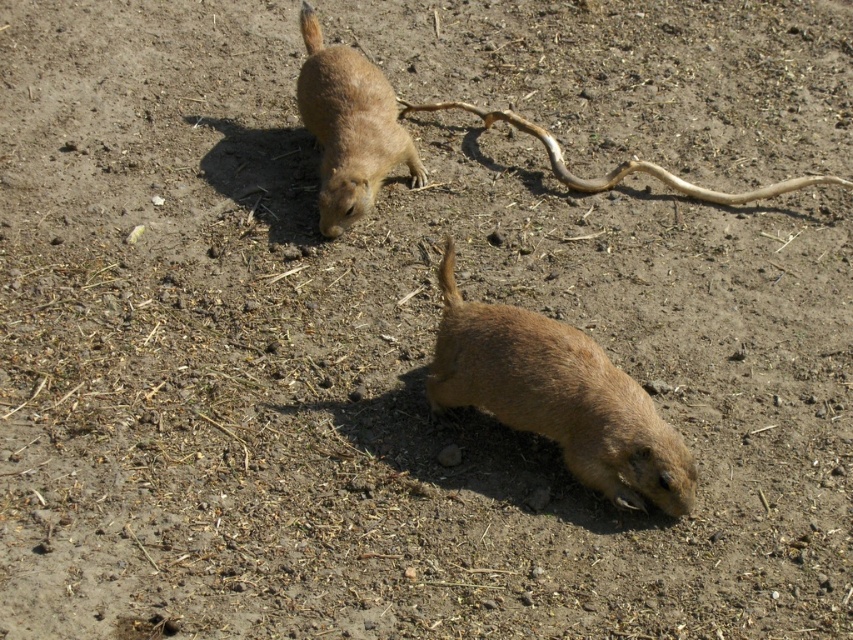
You are standing in the prairie and want to take a photo of the point at coordinates point (399, 132). If your camera has a maximum focus range of 3 meters, will it be able to focus on that point?

The distance of point (399, 132) from the camera is 3.75 meters, which exceeds the camera maximum focus range of 3 meters. Therefore, the camera will not be able to focus on that point.

Consider the image. You are a wildlife photographer observing the scene. You need to capture a closeup shot of the brown furry ground squirrel at upper center and the brown fur tail at lower center. Which animal should you zoom in more on to ensure both are visible in the frame?

You should zoom in more on the brown fur tail at lower center because the brown furry ground squirrel at upper center is larger in size, so focusing on the smaller one ensures both fit in the frame.

You are observing two prairie dogs in their natural habitat. You notice both have tails with brown fur. Which tail, the brown fur tail at lower center or the brown fur tail at upper center, is positioned closer to you?

The brown fur tail at lower center is closer to the viewer than the brown fur tail at upper center.